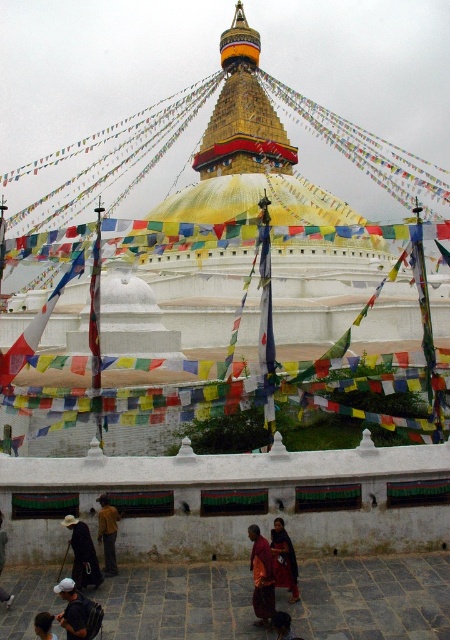
You are a photographer standing in front of the Boudhanath Stupa and notice two jackets at the lower left corner of your viewfinder. Which jacket is taller between the yellow fabric jacket at lower left and the dark brown leather jacket at lower left?

The yellow fabric jacket at lower left is taller than the dark brown leather jacket at lower left according to the description.

You are a traveler who wants to choose a jacket to wear for the cold weather in Kathmandu. You see the yellow fabric jacket at lower left and the dark brown leather jacket at lower left. Which jacket would be more suitable based on their sizes?

The yellow fabric jacket at lower left has a larger size compared to the dark brown leather jacket at lower left. Therefore, the yellow fabric jacket at lower left would be more suitable if you need a larger size for comfort in the cold weather.

You are a photographer planning to take a photo of the dark red robe at center and the dark gray backpack at lower left. Which object should you focus on first if you want to capture both in a single frame without moving the camera? Explain your reasoning based on their sizes.

The dark red robe at center is bigger than the dark gray backpack at lower left. Therefore, you should focus on the dark red robe at center first since it occupies more space in the frame, ensuring it is properly in focus before adjusting for the smaller backpack.